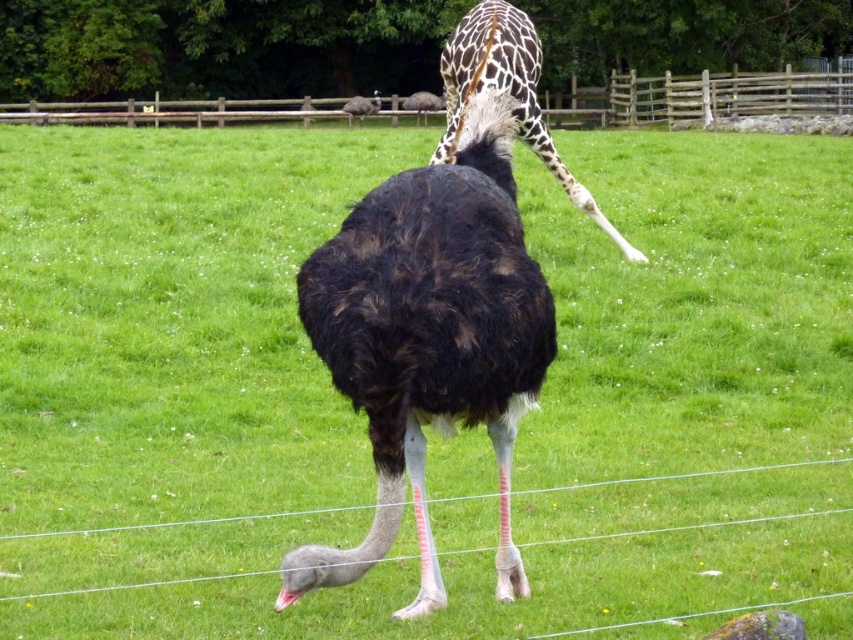
Based on the photo, you are a zookeeper standing at the entrance of the enclosure. You need to locate the dark brown feathers at center. Where would you look relative to the ostrich?

The dark brown feathers at center are located at the ostrich since the ostrich has dark brown feathers at center.